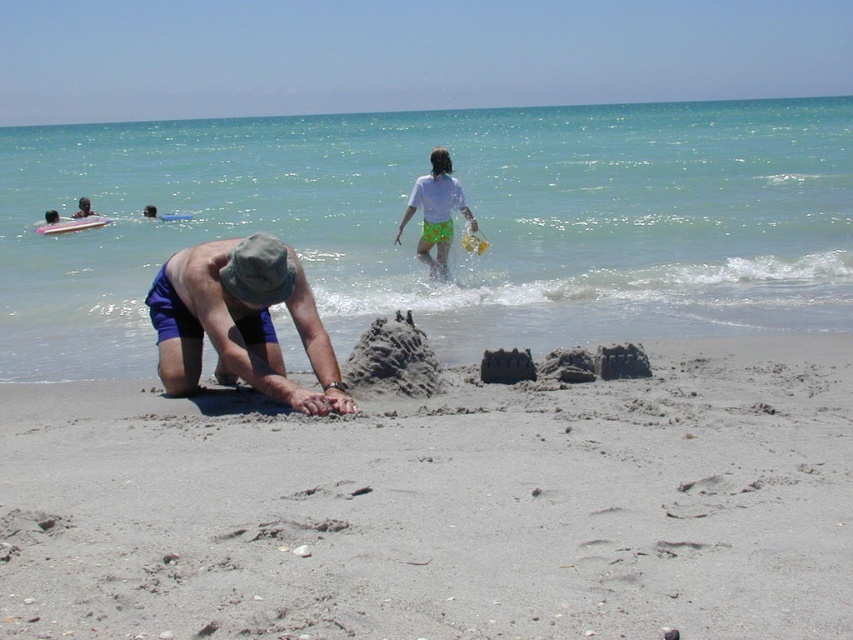
You are a photographer standing at the beach scene. You want to take a photo focusing on the brown fabric hat at center and the white cotton shirt at upper center. Which object should you zoom in on first to ensure both are in focus?

The brown fabric hat at center is closer to the viewer than the white cotton shirt at upper center, so you should zoom in on the brown fabric hat at center first to ensure both are in focus.